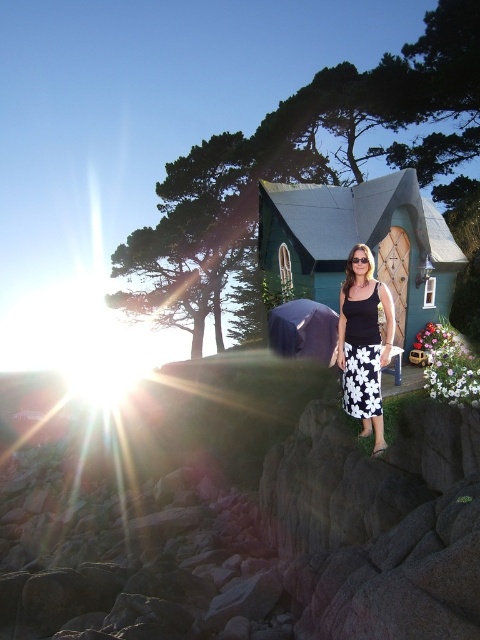
Is gray rock at lower center in front of black printed skirt at center?

Yes, gray rock at lower center is closer to the viewer.

Does gray rock at lower center have a greater width compared to black printed skirt at center?

Indeed, gray rock at lower center has a greater width compared to black printed skirt at center.

What do you see at coordinates (245, 518) in the screenshot?
I see `gray rock at lower center` at bounding box center [245, 518].

You are a GUI agent. You are given a task and a screenshot of the screen. Output one action in this format:
    pyautogui.click(x=<x>, y=<y>)
    Task: Click on the gray rock at lower center
    The height and width of the screenshot is (640, 480).
    Given the screenshot: What is the action you would take?
    pyautogui.click(x=245, y=518)

From the picture: Who is lower down, black printed skirt at center or black floral skirt at center?

black floral skirt at center is lower down.

The width and height of the screenshot is (480, 640). What are the coordinates of `black printed skirt at center` in the screenshot? It's located at (363, 342).

Locate an element on the screen. Image resolution: width=480 pixels, height=640 pixels. black printed skirt at center is located at coordinates (363, 342).

Does gray rock at lower center have a lesser height compared to black floral skirt at center?

No.

Which is in front, point (479, 544) or point (357, 337)?

Positioned in front is point (479, 544).

Which is behind, point (82, 600) or point (360, 387)?

The point (82, 600) is behind.

Where is `gray rock at lower center`? The height and width of the screenshot is (640, 480). gray rock at lower center is located at coordinates (245, 518).